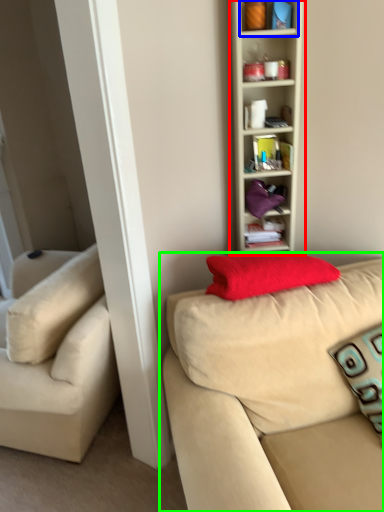
Question: Estimate the real-world distances between objects in this image. Which object is farther from shelf (highlighted by a red box), cabinet (highlighted by a blue box) or studio couch (highlighted by a green box)?

Choices:
 (A) cabinet
 (B) studio couch

Answer: (B)